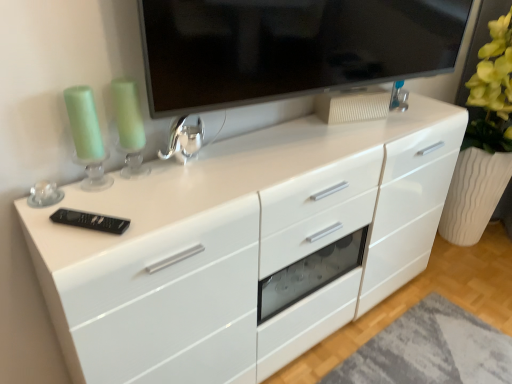
Question: Based on their sizes in the image, would you say shiny metallic faucet at center, the second appliance positioned from the bottom, is bigger or smaller than black plastic remote at lower left, the 1th appliance in the front-to-back sequence?

Choices:
 (A) small
 (B) big

Answer: (B)

Question: Is shiny metallic faucet at center, which is the 1th appliance in back-to-front order, wider or thinner than black plastic remote at lower left, which appears as the 1th appliance when viewed from the left?

Choices:
 (A) thin
 (B) wide

Answer: (A)

Question: Which of these objects is positioned closest to the matte black tv at upper center?

Choices:
 (A) white glossy chest of drawers at center
 (B) black plastic remote at lower left, positioned as the second appliance in back-to-front order
 (C) shiny metallic faucet at center, which is the 1th appliance in back-to-front order

Answer: (C)

Question: Which object is the farthest from the black plastic remote at lower left, the 1th appliance in the front-to-back sequence?

Choices:
 (A) matte black tv at upper center
 (B) white glossy chest of drawers at center
 (C) shiny metallic faucet at center, which is the 1th appliance in back-to-front order

Answer: (A)